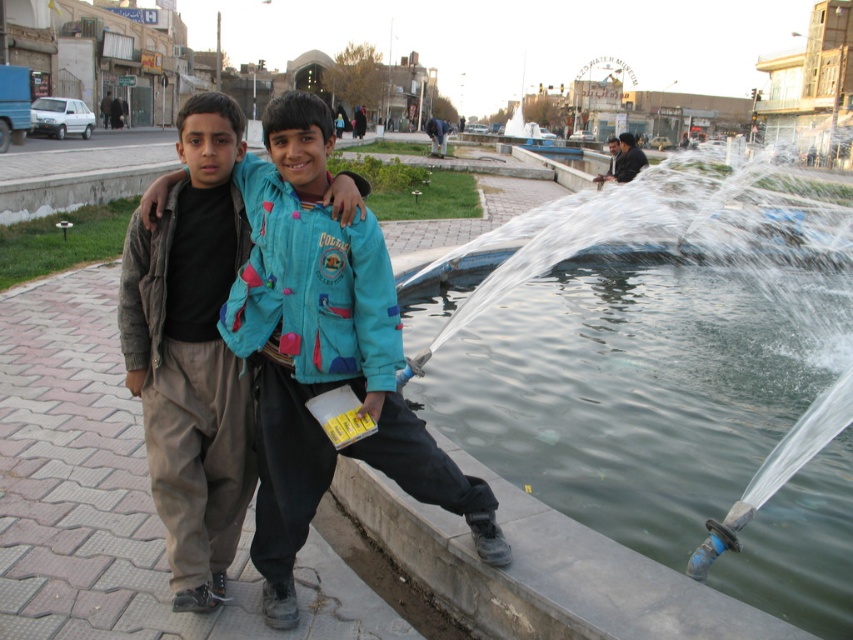
Question: From the image, what is the correct spatial relationship of clear plastic water at center right in relation to teal fabric jacket at center?

Choices:
 (A) above
 (B) below

Answer: (A)

Question: Does clear plastic water at center right appear under teal fabric jacket at center?

Choices:
 (A) no
 (B) yes

Answer: (A)

Question: Which point is farther from the camera taking this photo?

Choices:
 (A) (438, 499)
 (B) (751, 275)

Answer: (B)

Question: Does clear plastic water at center right appear on the right side of teal fabric jacket at center?

Choices:
 (A) no
 (B) yes

Answer: (B)